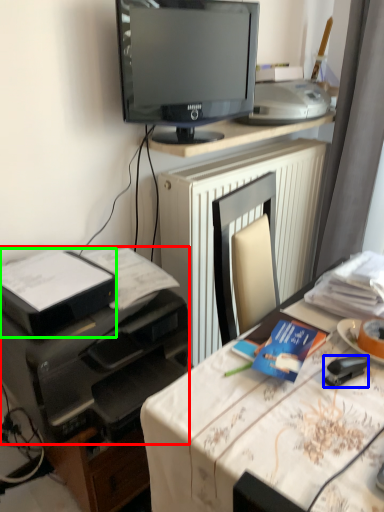
Question: Which object is positioned closest to printer (highlighted by a red box)? Select from stapler (highlighted by a blue box) and printer (highlighted by a green box).

Choices:
 (A) stapler
 (B) printer

Answer: (B)